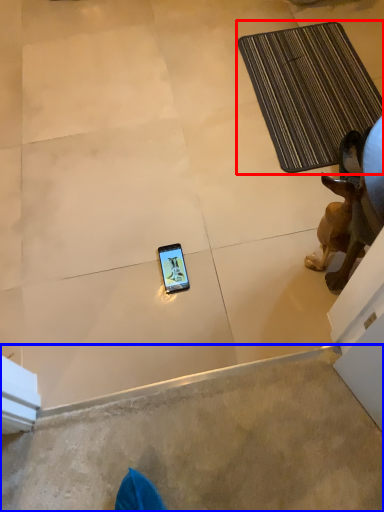
Question: Which object is further to the camera taking this photo, bath mat (highlighted by a red box) or concrete (highlighted by a blue box)?

Choices:
 (A) bath mat
 (B) concrete

Answer: (A)